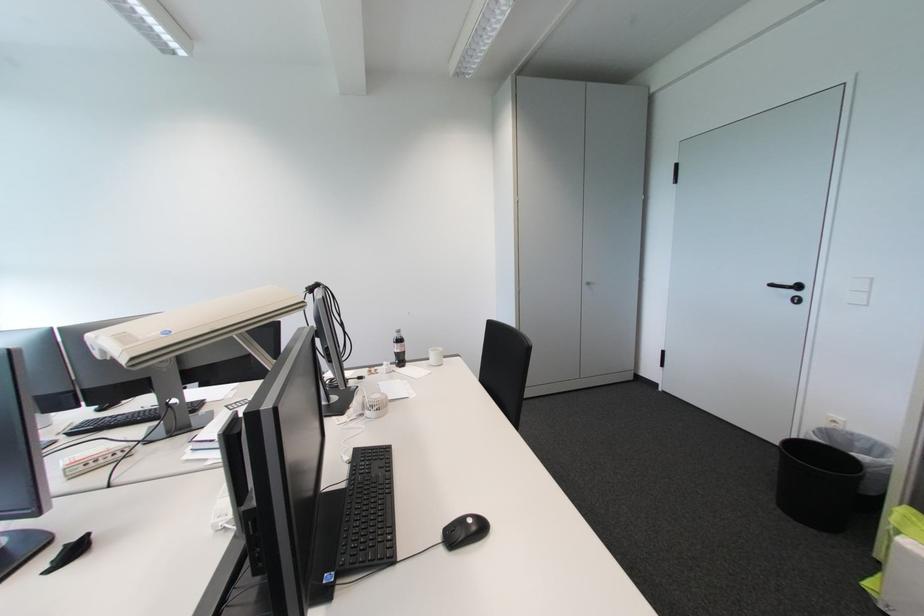
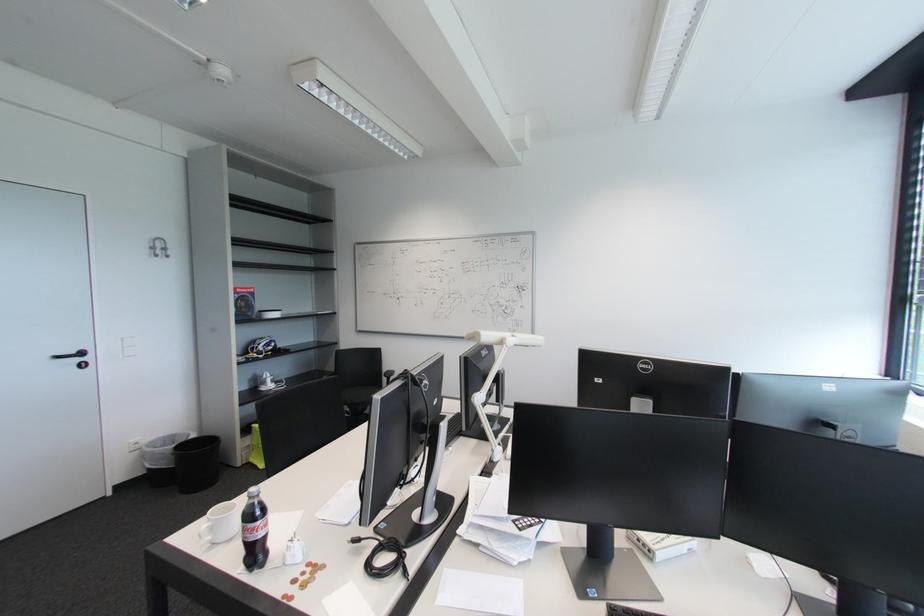
The point at (797,294) is marked in the first image. Where is the corresponding point in the second image?

(83, 361)